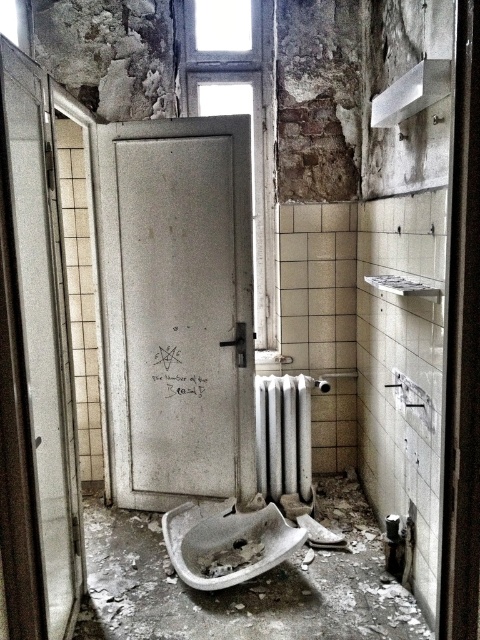
Question: Which point is farther to the camera?

Choices:
 (A) cracked porcelain sink at lower center
 (B) cracked porcelain sink at center
 (C) white textured radiator at center
 (D) white plastic towel bar at upper center

Answer: (D)

Question: Is cracked porcelain sink at lower center thinner than white plastic towel bar at upper center?

Choices:
 (A) yes
 (B) no

Answer: (B)

Question: Which object is positioned farthest from the white plastic towel bar at upper center?

Choices:
 (A) cracked porcelain sink at center
 (B) white textured radiator at center

Answer: (A)

Question: Which object is the farthest from the cracked porcelain sink at center?

Choices:
 (A) white plastic towel bar at upper center
 (B) cracked porcelain sink at lower center

Answer: (A)

Question: In this image, where is cracked porcelain sink at lower center located relative to white textured radiator at center?

Choices:
 (A) right
 (B) left

Answer: (B)

Question: Is cracked porcelain sink at lower center behind white plastic towel bar at upper center?

Choices:
 (A) yes
 (B) no

Answer: (B)